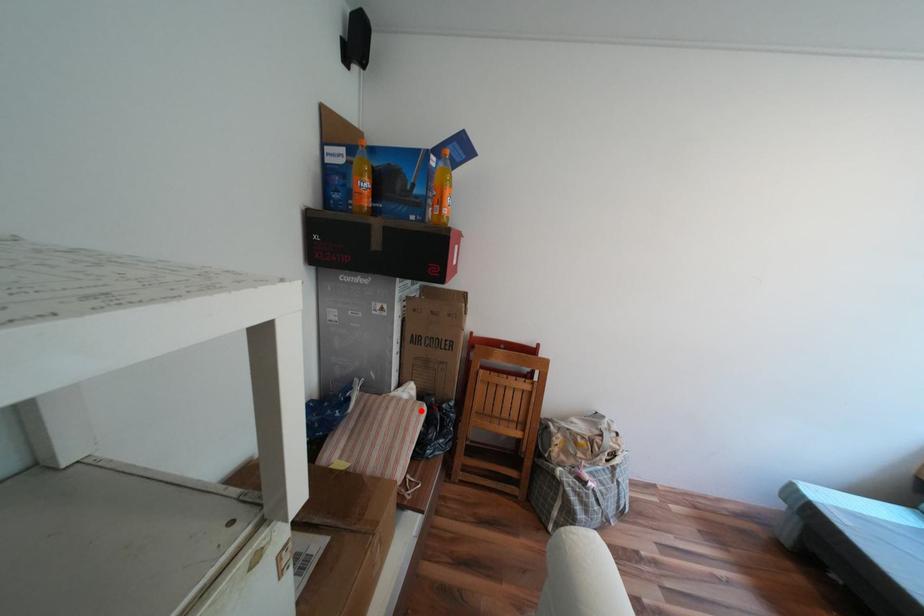
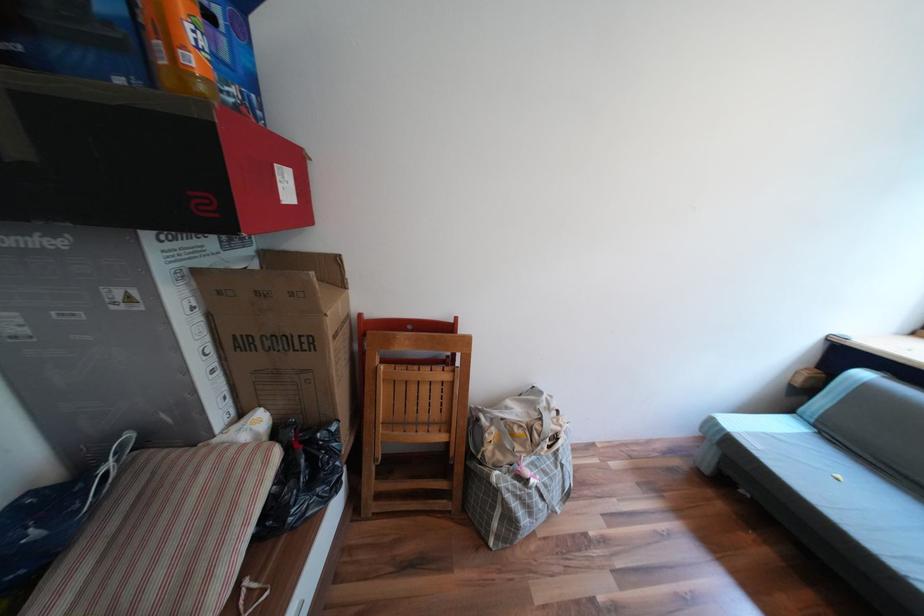
In the second image, find the point that corresponds to the highlighted location in the first image.

(258, 464)